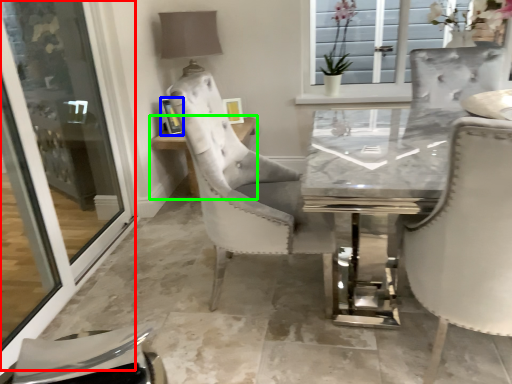
Question: Estimate the real-world distances between objects in this image. Which object is farther from screen door (highlighted by a red box), picture frame (highlighted by a blue box) or table (highlighted by a green box)?

Choices:
 (A) picture frame
 (B) table

Answer: (A)